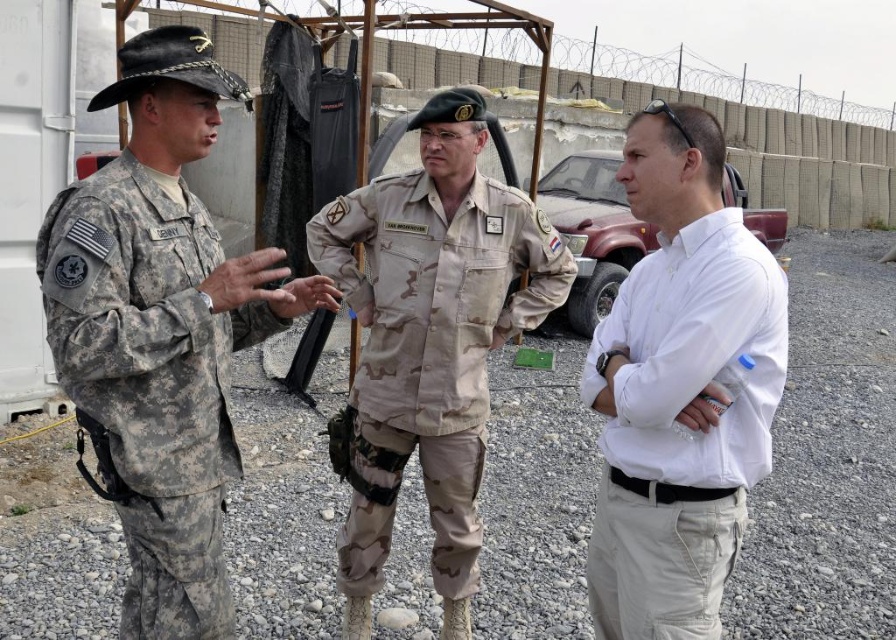
Question: Which is farther from the white cotton shirt at right?

Choices:
 (A) camouflage fabric uniform at left
 (B) camouflage fabric uniform at center

Answer: (A)

Question: Is white cotton shirt at right to the right of camouflage fabric uniform at left from the viewer's perspective?

Choices:
 (A) yes
 (B) no

Answer: (A)

Question: From the image, what is the correct spatial relationship of camouflage fabric uniform at left in relation to camouflage fabric uniform at center?

Choices:
 (A) above
 (B) below

Answer: (A)

Question: Which of the following is the farthest from the observer?

Choices:
 (A) (778, 369)
 (B) (382, 333)

Answer: (B)

Question: Which point is closer to the camera taking this photo?

Choices:
 (A) (774, 348)
 (B) (497, 248)

Answer: (A)

Question: Is camouflage fabric uniform at left below camouflage fabric uniform at center?

Choices:
 (A) yes
 (B) no

Answer: (B)